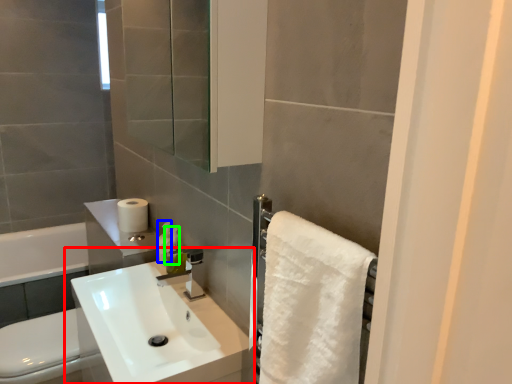
Question: Which is nearer to the sink (highlighted by a red box)? toiletry (highlighted by a blue box) or soap dispenser (highlighted by a green box).

Choices:
 (A) toiletry
 (B) soap dispenser

Answer: (B)